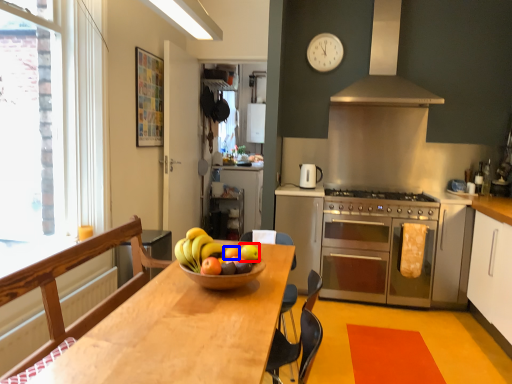
Question: Which point is further to the camera, apple (highlighted by a red box) or orange (highlighted by a blue box)?

Choices:
 (A) apple
 (B) orange

Answer: (B)